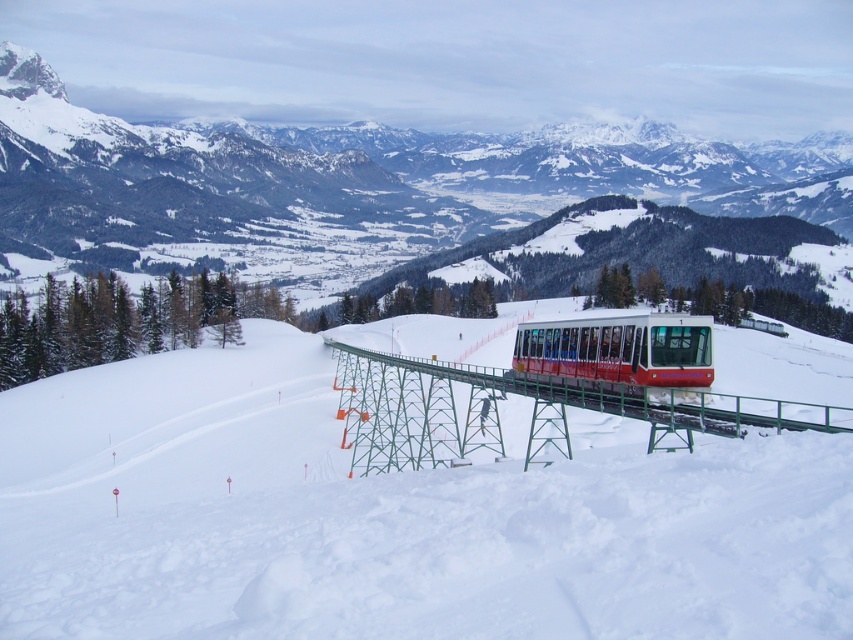
Which is behind, point (309, 342) or point (242, 189)?

Point (242, 189)

Is point (556, 556) behind point (851, 218)?

No, it is in front of (851, 218).

Is point (45, 477) less distant than point (738, 179)?

That is True.

Identify the location of white snow ski slope at center. This screenshot has height=640, width=853. [393, 516].

Is point (239, 156) positioned behind point (593, 376)?

Yes, it is.

Does white snow-covered mountain at center appear over red matte train at center?

Indeed, white snow-covered mountain at center is positioned over red matte train at center.

Does point (367, 141) come farther from viewer compared to point (599, 321)?

Yes, point (367, 141) is behind point (599, 321).

The height and width of the screenshot is (640, 853). Identify the location of white snow-covered mountain at center. (350, 186).

Who is shorter, white snow ski slope at center or metallic red bridge at center?

With less height is metallic red bridge at center.

Who is positioned more to the left, white snow ski slope at center or metallic red bridge at center?

white snow ski slope at center is more to the left.

Is point (503, 488) behind point (357, 449)?

No, (503, 488) is closer to viewer.

What are the coordinates of `white snow ski slope at center` in the screenshot? It's located at (393, 516).